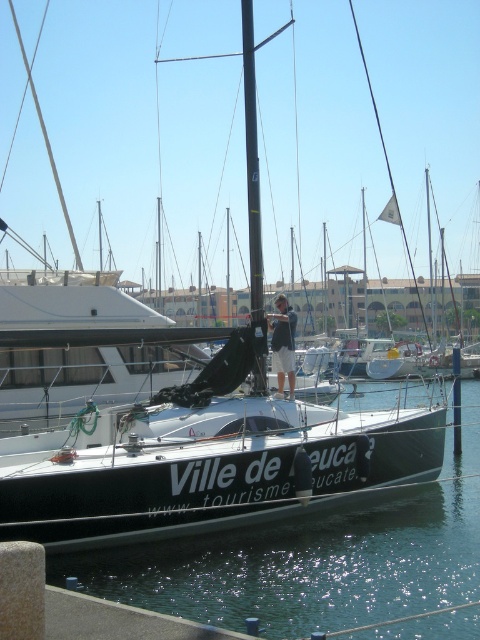
Which is below, clear water at center or dark blue shorts at center?

clear water at center is below.

Is clear water at center positioned before dark blue shorts at center?

That is True.

In order to click on clear water at center in this screenshot , I will do `click(312, 560)`.

The image size is (480, 640). In order to click on clear water at center in this screenshot , I will do `click(312, 560)`.